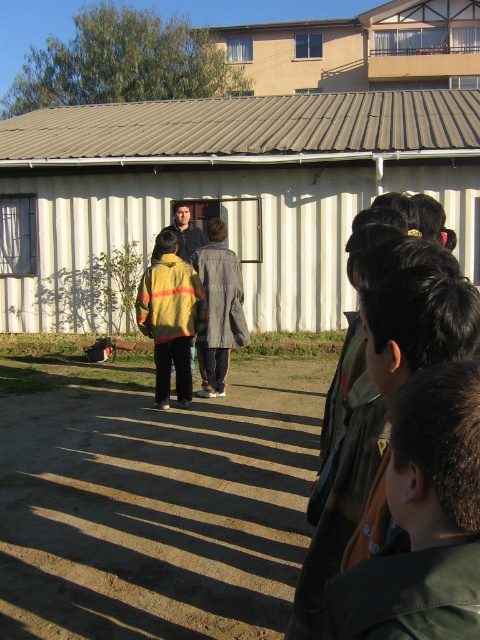
Question: Is gray fabric coat at center smaller than matte black jacket at center?

Choices:
 (A) yes
 (B) no

Answer: (B)

Question: Observing the image, what is the correct spatial positioning of gray fabric coat at center in reference to yellow jacket at center?

Choices:
 (A) above
 (B) below

Answer: (B)

Question: Among these points, which one is farthest from the camera?

Choices:
 (A) (230, 288)
 (B) (191, 353)
 (C) (243, 163)
 (D) (187, 225)

Answer: (C)

Question: Based on their relative distances, which object is nearer to the gray fabric coat at center?

Choices:
 (A) yellow jacket at center
 (B) matte black jacket at center

Answer: (B)

Question: In this image, where is gray fabric coat at center located relative to yellow jacket at center?

Choices:
 (A) left
 (B) right

Answer: (B)

Question: Which of these objects is positioned closest to the white corrugated metal shed at center?

Choices:
 (A) matte black jacket at center
 (B) gray fabric coat at center

Answer: (A)